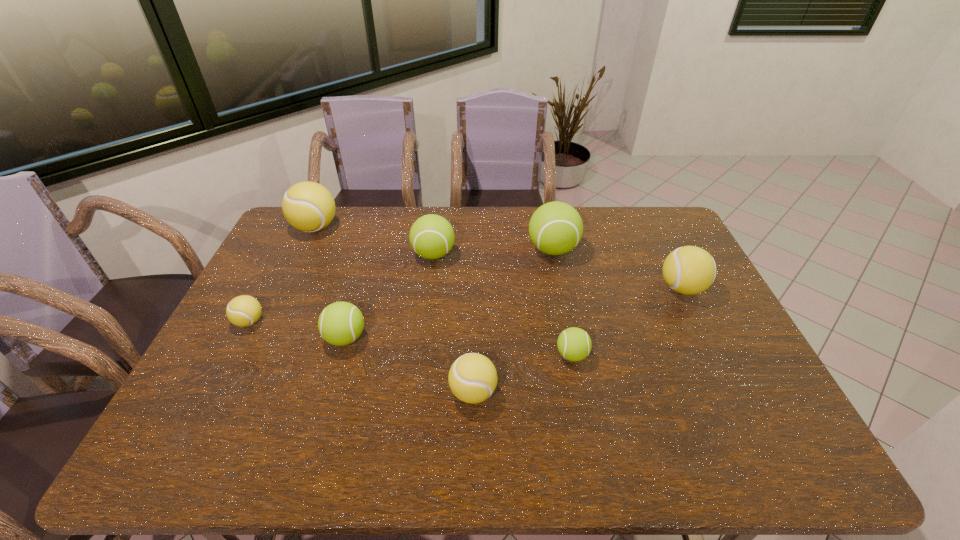
Locate an element on the screen. The image size is (960, 540). the farthest yellow tennis ball is located at coordinates (308, 206).

Where is `the biggest green tennis ball`? the biggest green tennis ball is located at coordinates (555, 228).

What are the coordinates of `the fourth tennis ball from left to right` in the screenshot? It's located at (431, 236).

At what (x,y) coordinates should I click in order to perform the action: click on the fifth object from right to left. Please return your answer as a coordinate pair (x, y). This screenshot has height=540, width=960. Looking at the image, I should click on (431, 236).

Find the location of a particular element. the rightmost yellow tennis ball is located at coordinates (689, 270).

I want to click on the rightmost tennis ball, so click(689, 270).

This screenshot has height=540, width=960. I want to click on the third tennis ball from left to right, so click(x=341, y=323).

The width and height of the screenshot is (960, 540). In order to click on the leftmost green tennis ball in this screenshot , I will do `click(341, 323)`.

The width and height of the screenshot is (960, 540). Find the location of `the nearest object`. the nearest object is located at coordinates (472, 378).

Where is `the nearest yellow tennis ball`? The width and height of the screenshot is (960, 540). the nearest yellow tennis ball is located at coordinates (472, 378).